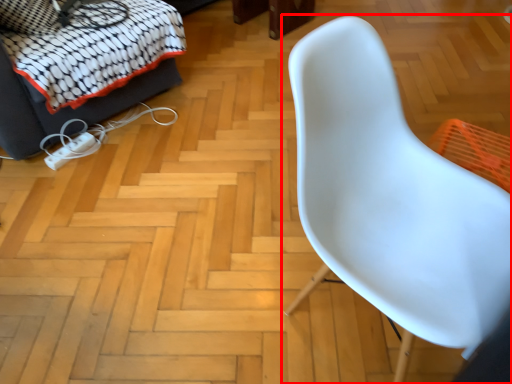
Question: From the image, what is the correct spatial relationship of chair (annotated by the red box) in relation to furniture?

Choices:
 (A) left
 (B) right

Answer: (B)